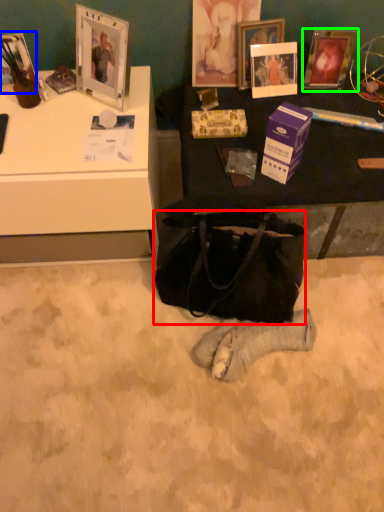
Question: Estimate the real-world distances between objects in this image. Which object is closer to handbag (highlighted by a red box), picture frame (highlighted by a blue box) or picture frame (highlighted by a green box)?

Choices:
 (A) picture frame
 (B) picture frame

Answer: (B)